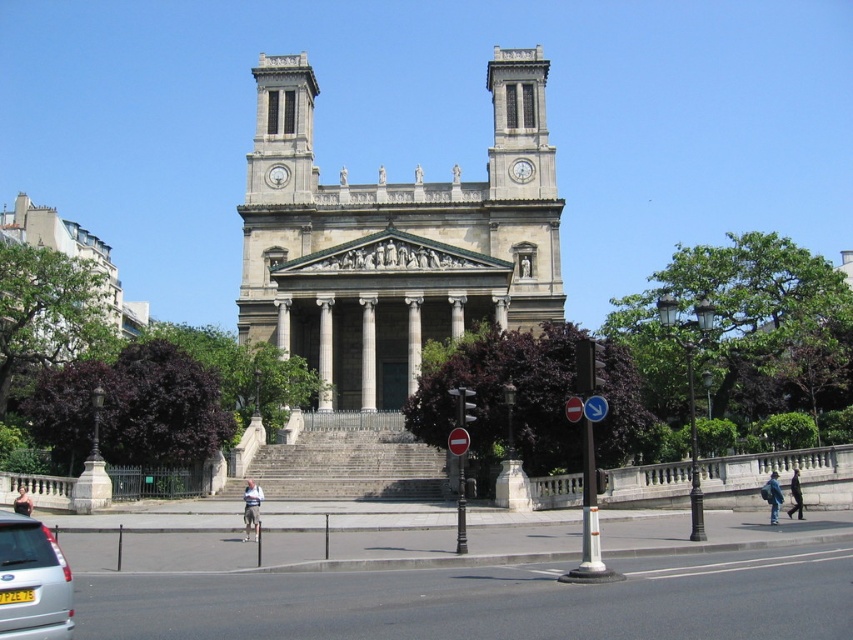
Does silver metallic car at lower left have a larger size compared to white glossy clock at upper center?

Yes, silver metallic car at lower left is bigger than white glossy clock at upper center.

Who is lower down, silver metallic car at lower left or white glossy clock at upper center?

silver metallic car at lower left

Between point (33, 588) and point (520, 172), which one is positioned behind?

The point (520, 172) is more distant.

This screenshot has width=853, height=640. In order to click on silver metallic car at lower left in this screenshot , I will do `click(32, 580)`.

Does white marble column at center have a lesser height compared to white glossy clock at upper center?

No, white marble column at center is not shorter than white glossy clock at upper center.

Can you confirm if white marble column at center is bigger than white glossy clock at upper center?

Indeed, white marble column at center has a larger size compared to white glossy clock at upper center.

What do you see at coordinates (368, 353) in the screenshot? I see `white marble column at center` at bounding box center [368, 353].

The width and height of the screenshot is (853, 640). Identify the location of white marble column at center. (368, 353).

Does white stone church at center appear on the right side of silver metallic car at lower left?

Correct, you'll find white stone church at center to the right of silver metallic car at lower left.

Who is more distant from viewer, (556, 276) or (1, 634)?

The point (556, 276) is more distant.

Where is `white stone church at center`? white stone church at center is located at coordinates (393, 237).